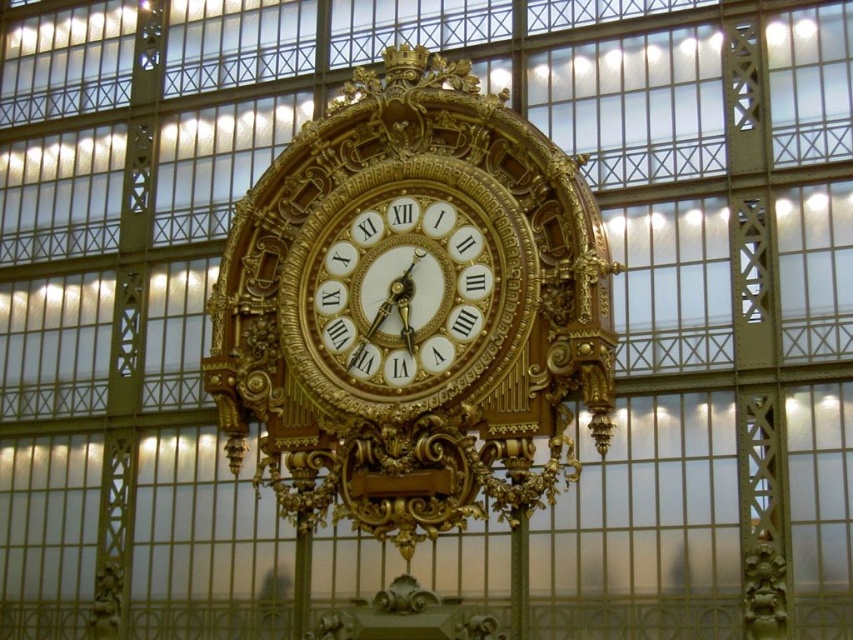
Question: Is gold ornate clock at center to the right of gold metallic clock at center from the viewer's perspective?

Choices:
 (A) no
 (B) yes

Answer: (B)

Question: Can you confirm if gold ornate clock at center is thinner than gold metallic clock at center?

Choices:
 (A) yes
 (B) no

Answer: (B)

Question: Can you confirm if gold ornate clock at center is positioned to the right of gold metallic clock at center?

Choices:
 (A) no
 (B) yes

Answer: (B)

Question: Which point is farther to the camera?

Choices:
 (A) gold metallic clock at center
 (B) gold ornate clock at center

Answer: (A)